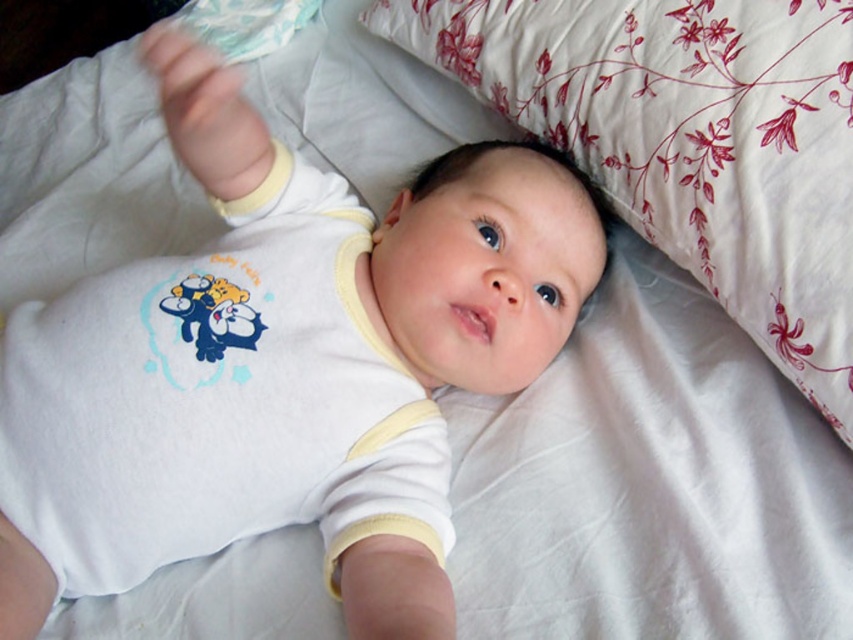
Question: Can you confirm if white floral pillow at upper center is bigger than white cotton onesie at center?

Choices:
 (A) yes
 (B) no

Answer: (A)

Question: Is white floral pillow at upper center smaller than white cotton onesie at center?

Choices:
 (A) yes
 (B) no

Answer: (B)

Question: Is white floral pillow at upper center below white cotton onesie at center?

Choices:
 (A) no
 (B) yes

Answer: (A)

Question: Which point is closer to the camera taking this photo?

Choices:
 (A) (682, 204)
 (B) (32, 556)

Answer: (B)